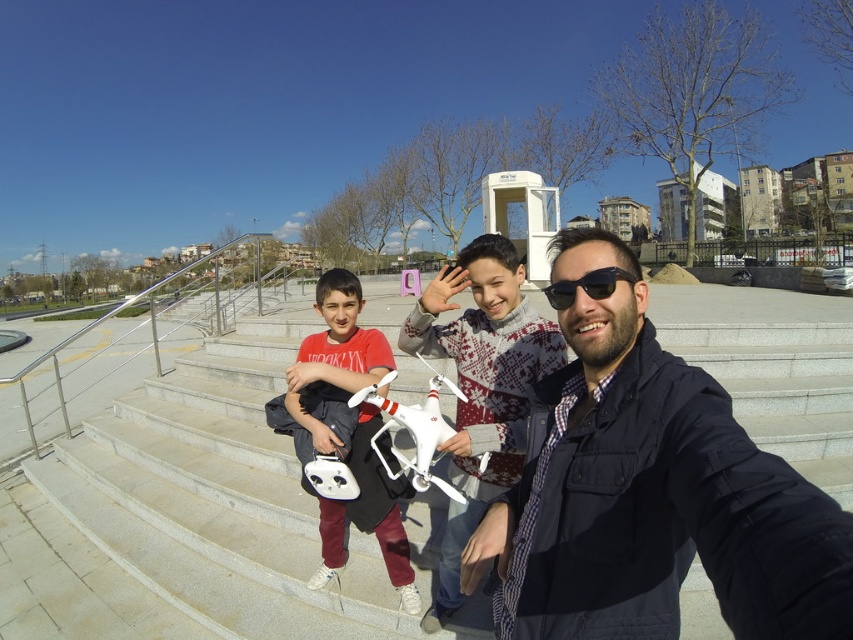
Question: Is gray concrete stairs at center wider than sunglasses at center?

Choices:
 (A) yes
 (B) no

Answer: (A)

Question: Observing the image, what is the correct spatial positioning of white matte drone at center in reference to sunglasses at center?

Choices:
 (A) right
 (B) left

Answer: (B)

Question: Which of the following is the farthest from the observer?

Choices:
 (A) (314, 573)
 (B) (283, 465)

Answer: (B)

Question: Where is gray concrete stairs at center located in relation to white matte drone at center in the image?

Choices:
 (A) right
 (B) left

Answer: (B)

Question: Which point is farther to the camera?

Choices:
 (A) (238, 332)
 (B) (514, 397)

Answer: (A)

Question: Among these points, which one is farthest from the camera?

Choices:
 (A) (351, 349)
 (B) (824, 561)

Answer: (A)